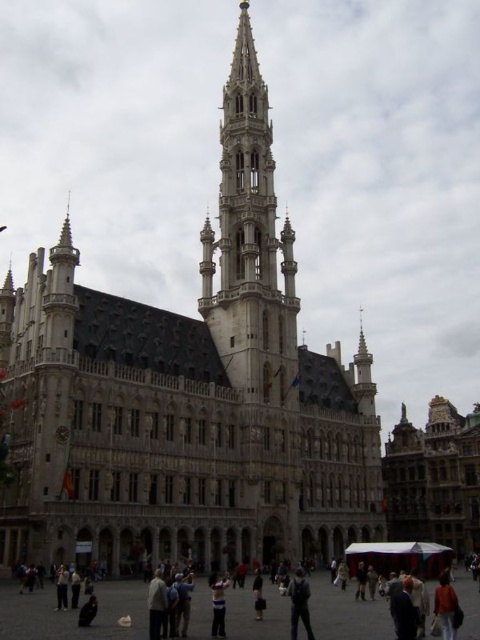
Question: Which object appears closest to the camera in this image?

Choices:
 (A) brick paved square at center
 (B) brown stone church at center

Answer: (A)

Question: Can you confirm if dark blue suit at center is positioned above light brown leather jacket at center?

Choices:
 (A) yes
 (B) no

Answer: (A)

Question: Is brown stone church at center to the left of dark gray pants at center from the viewer's perspective?

Choices:
 (A) yes
 (B) no

Answer: (A)

Question: Does brown stone church at center appear on the left side of polished stone tower at center?

Choices:
 (A) no
 (B) yes

Answer: (A)

Question: Among these points, which one is nearest to the camera?

Choices:
 (A) (452, 612)
 (B) (393, 600)
 (C) (201, 595)
 (D) (288, 582)

Answer: (B)

Question: Based on their relative distances, which object is farther from the orange fabric jacket at lower right?

Choices:
 (A) polished stone tower at center
 (B) striped shirt at center
 (C) brick paved square at center

Answer: (A)